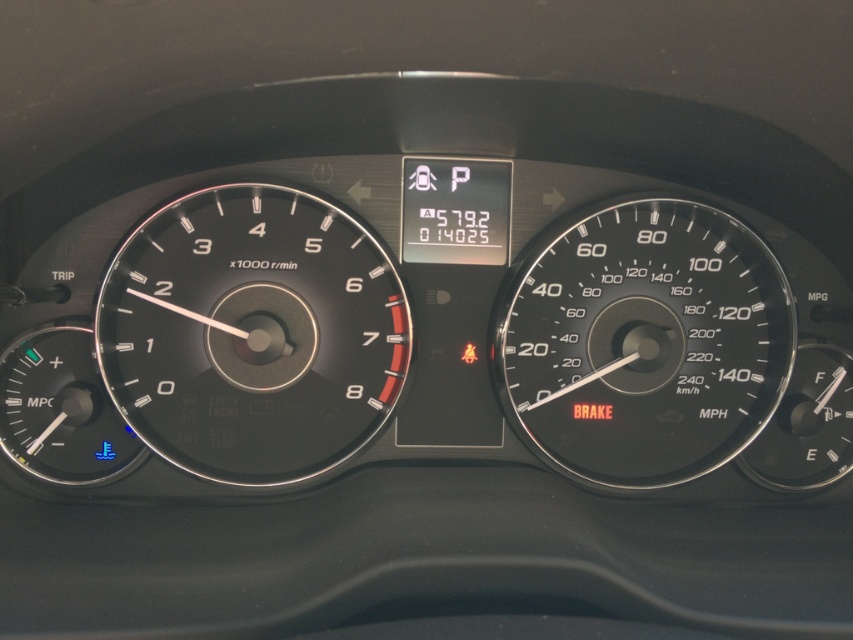
Is black matte speedometer at center to the left of black plastic speedometer at center right from the viewer's perspective?

Indeed, black matte speedometer at center is positioned on the left side of black plastic speedometer at center right.

Can you confirm if black matte speedometer at center is positioned above black plastic speedometer at center right?

Indeed, black matte speedometer at center is positioned over black plastic speedometer at center right.

Where is `black matte speedometer at center`? The width and height of the screenshot is (853, 640). black matte speedometer at center is located at coordinates (252, 333).